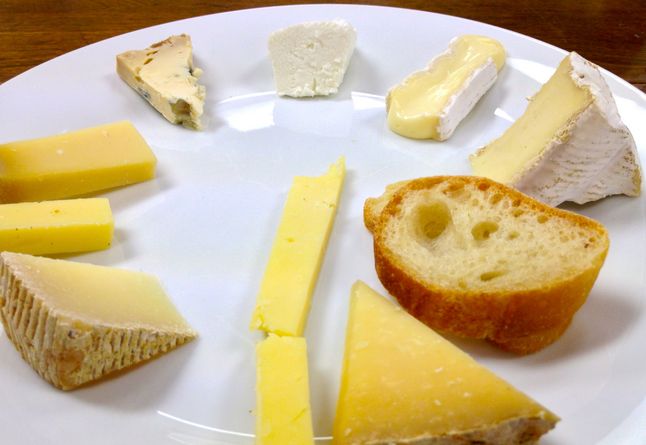
At what (x,y) coordinates should I click in order to perform the action: click on table. Please return your answer as a coordinate pair (x, y). The width and height of the screenshot is (646, 445). Looking at the image, I should click on (28, 29).